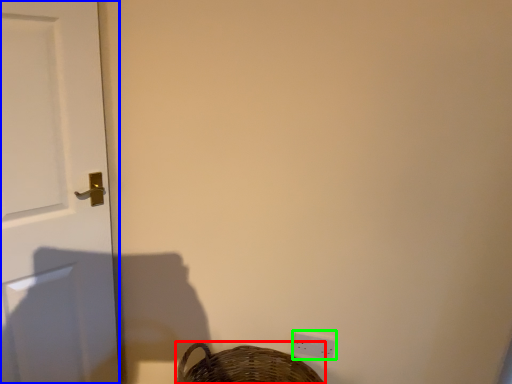
Question: Based on their relative distances, which object is farther from basket (highlighted by a red box)? Choose from door (highlighted by a blue box) and light switch (highlighted by a green box).

Choices:
 (A) door
 (B) light switch

Answer: (A)